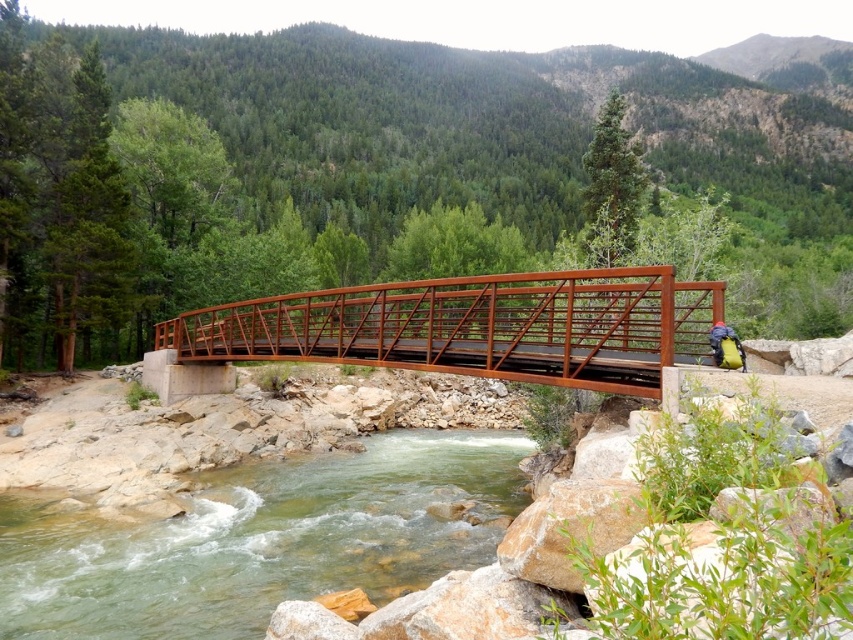
Question: Is the position of green smooth water at center more distant than that of yellow fabric backpack at center-right?

Choices:
 (A) yes
 (B) no

Answer: (B)

Question: Estimate the real-world distances between objects in this image. Which object is closer to the yellow fabric backpack at center-right?

Choices:
 (A) green smooth water at center
 (B) rustic metal bridge at center

Answer: (B)

Question: Which point is closer to the camera?

Choices:
 (A) green smooth water at center
 (B) rustic metal bridge at center

Answer: (B)

Question: Is green smooth water at center further to camera compared to yellow fabric backpack at center-right?

Choices:
 (A) yes
 (B) no

Answer: (B)

Question: Which point is closer to the camera?

Choices:
 (A) rustic metal bridge at center
 (B) yellow fabric backpack at center-right
 (C) green smooth water at center

Answer: (A)

Question: Does rustic metal bridge at center have a greater width compared to yellow fabric backpack at center-right?

Choices:
 (A) no
 (B) yes

Answer: (B)